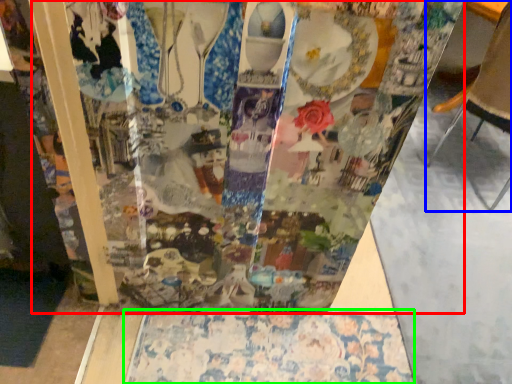
Question: Which object is the closest to the glass box (highlighted by a red box)? Choose among these: furniture (highlighted by a blue box) or tablecloth (highlighted by a green box).

Choices:
 (A) furniture
 (B) tablecloth

Answer: (B)